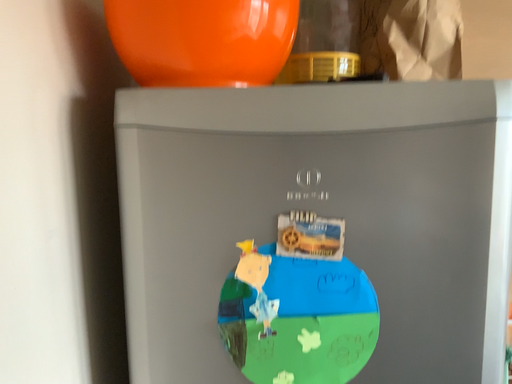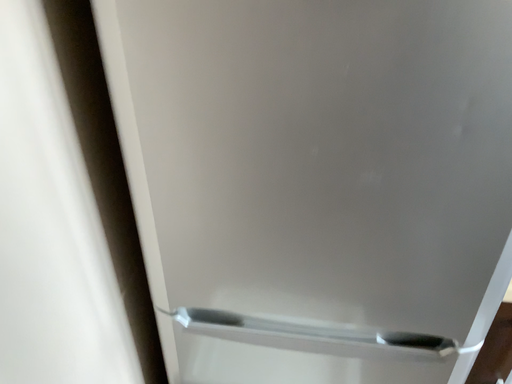
Question: Which way did the camera rotate in the video?

Choices:
 (A) rotated upward
 (B) rotated downward

Answer: (B)